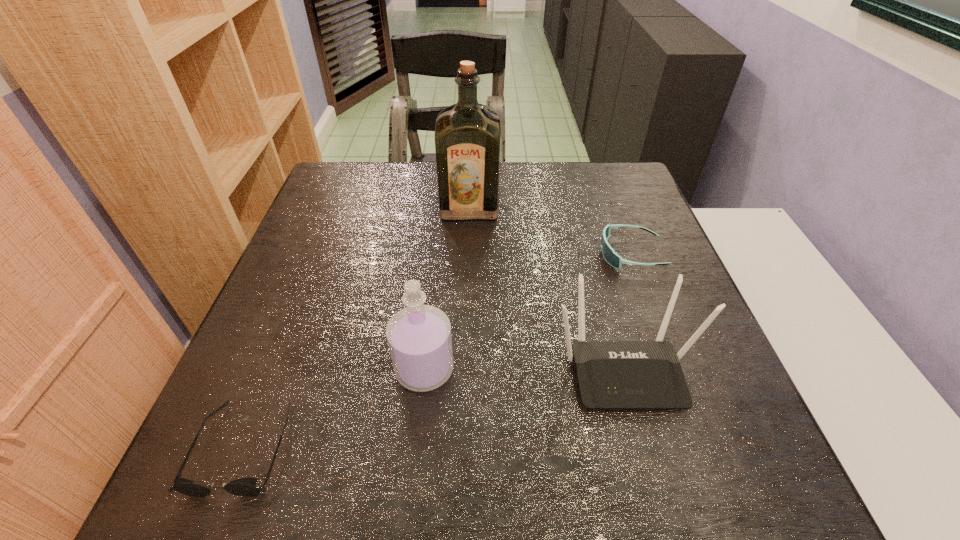
At what (x,y) coordinates should I click in order to perform the action: click on vacant region at the left edge of the desktop. Please return your answer as a coordinate pair (x, y). The height and width of the screenshot is (540, 960). Looking at the image, I should click on (313, 338).

The image size is (960, 540). Identify the location of vacant space at the right edge of the desktop. [638, 290].

Where is `vacant space at the far right corner of the desktop`? vacant space at the far right corner of the desktop is located at coordinates (596, 165).

I want to click on free location at the near right corner of the desktop, so click(761, 450).

Identify the location of vacant space that is in between the goggles and the third shortest object. Image resolution: width=960 pixels, height=540 pixels. (628, 311).

Find the location of a particular element. The width and height of the screenshot is (960, 540). free point between the fourth shortest object and the leftmost object is located at coordinates (334, 408).

You are a GUI agent. You are given a task and a screenshot of the screen. Output one action in this format:
    pyautogui.click(x=<x>, y=<y>)
    Task: Click on the vacant space in between the fourth nearest object and the farthest object
    This screenshot has width=960, height=540.
    Given the screenshot: What is the action you would take?
    pyautogui.click(x=550, y=231)

Locate an element on the screen. The image size is (960, 540). empty space between the router and the second tallest object is located at coordinates (524, 369).

Where is `free spot between the fourth shortest object and the sunglasses`? free spot between the fourth shortest object and the sunglasses is located at coordinates (334, 408).

Image resolution: width=960 pixels, height=540 pixels. In order to click on free spot between the goggles and the second tallest object in this screenshot , I will do `click(528, 312)`.